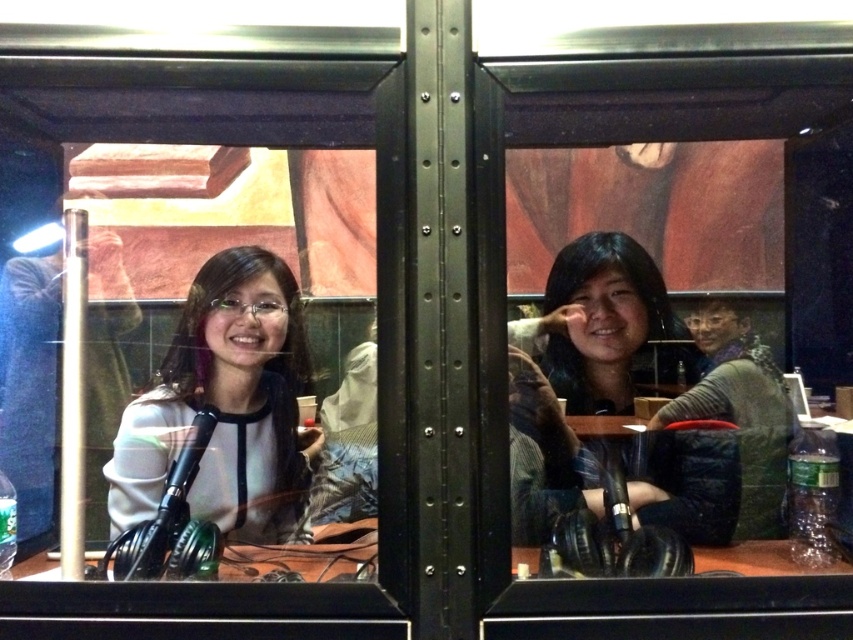
Question: Is white matte sweater at left positioned in front of matte black shirt at center?

Choices:
 (A) yes
 (B) no

Answer: (B)

Question: Does white matte sweater at left appear over matte black shirt at center?

Choices:
 (A) no
 (B) yes

Answer: (B)

Question: Is white matte sweater at left above matte black shirt at center?

Choices:
 (A) no
 (B) yes

Answer: (B)

Question: Which point is closer to the camera?

Choices:
 (A) matte black shirt at center
 (B) white matte sweater at left

Answer: (A)

Question: Which object appears farthest from the camera in this image?

Choices:
 (A) white matte sweater at left
 (B) matte black shirt at center

Answer: (A)